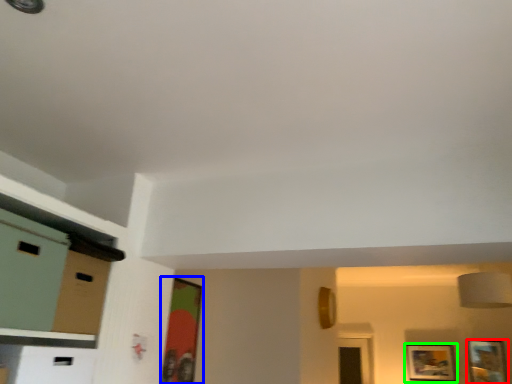
Question: Which object is positioned closest to picture frame (highlighted by a red box)? Select from picture frame (highlighted by a blue box) and picture frame (highlighted by a green box).

Choices:
 (A) picture frame
 (B) picture frame

Answer: (B)